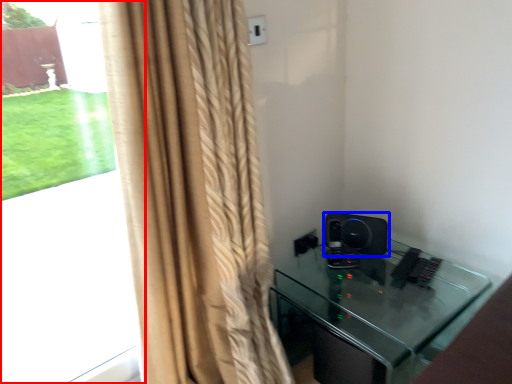
Question: Among these objects, which one is nearest to the camera, bay window (highlighted by a red box) or speaker (highlighted by a blue box)?

Choices:
 (A) bay window
 (B) speaker

Answer: (A)